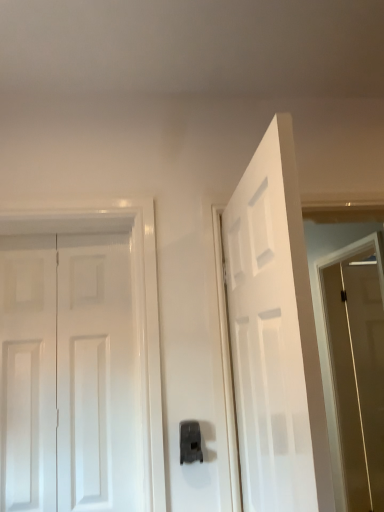
Question: Is black plastic door handle at center facing towards white glossy door at left, which ranks as the 2th door in right-to-left order?

Choices:
 (A) no
 (B) yes

Answer: (A)

Question: Is black plastic door handle at center bigger than white glossy door at left, arranged as the 1th door when viewed from the left?

Choices:
 (A) yes
 (B) no

Answer: (B)

Question: Is black plastic door handle at center far away from white glossy door at left, which ranks as the 2th door in right-to-left order?

Choices:
 (A) no
 (B) yes

Answer: (A)

Question: Does black plastic door handle at center appear on the right side of white glossy door at left, which ranks as the 2th door in right-to-left order?

Choices:
 (A) no
 (B) yes

Answer: (B)

Question: Does black plastic door handle at center have a lesser width compared to white glossy door at left, which ranks as the 2th door in right-to-left order?

Choices:
 (A) yes
 (B) no

Answer: (B)

Question: Is black plastic door handle at center to the left of white glossy door at left, which ranks as the 2th door in right-to-left order, from the viewer's perspective?

Choices:
 (A) yes
 (B) no

Answer: (B)

Question: Is white glossy door at left, which ranks as the 2th door in right-to-left order, looking in the opposite direction of black plastic door handle at center?

Choices:
 (A) yes
 (B) no

Answer: (B)

Question: From the image's perspective, would you say white glossy door at left, arranged as the 1th door when viewed from the left, is shown under black plastic door handle at center?

Choices:
 (A) no
 (B) yes

Answer: (A)

Question: Can you confirm if white glossy door at left, which ranks as the 2th door in right-to-left order, is wider than black plastic door handle at center?

Choices:
 (A) no
 (B) yes

Answer: (A)

Question: Does white glossy door at left, which ranks as the 2th door in right-to-left order, appear on the left side of black plastic door handle at center?

Choices:
 (A) yes
 (B) no

Answer: (A)

Question: Is the position of white glossy door at left, which ranks as the 2th door in right-to-left order, less distant than that of black plastic door handle at center?

Choices:
 (A) no
 (B) yes

Answer: (A)

Question: Does white glossy door at left, which ranks as the 2th door in right-to-left order, have a smaller size compared to black plastic door handle at center?

Choices:
 (A) yes
 (B) no

Answer: (B)

Question: Is black plastic door handle at center facing towards brown matte screen door at right?

Choices:
 (A) no
 (B) yes

Answer: (A)